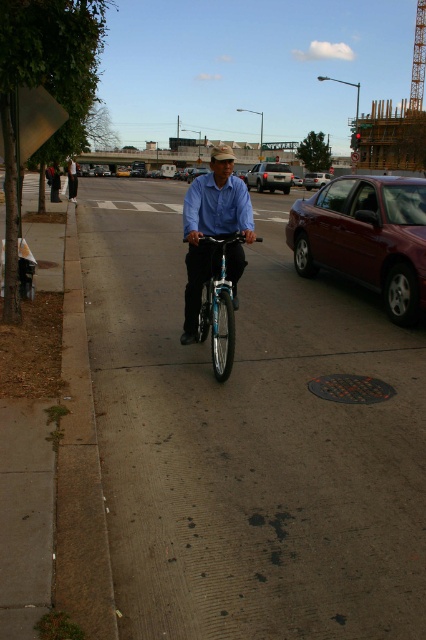
Looking at this image, who is shorter, matte silver suv at center or metallic silver sedan at center?

With less height is matte silver suv at center.

Is matte silver suv at center bigger than metallic silver sedan at center?

Actually, matte silver suv at center might be smaller than metallic silver sedan at center.

Who is more forward, (281, 173) or (314, 177)?

Point (281, 173) is in front.

Where is `matte silver suv at center`? This screenshot has height=640, width=426. matte silver suv at center is located at coordinates (270, 177).

Is gray concrete sidewalk at center bigger than shiny blue bicycle at center?

Indeed, gray concrete sidewalk at center has a larger size compared to shiny blue bicycle at center.

I want to click on gray concrete sidewalk at center, so click(249, 440).

This screenshot has width=426, height=640. What are the coordinates of `gray concrete sidewalk at center` in the screenshot? It's located at (249, 440).

Is point (233, 241) closer to camera compared to point (328, 177)?

That is True.

Who is positioned more to the right, shiny blue bicycle at center or metallic silver sedan at center?

Positioned to the right is metallic silver sedan at center.

Is point (219, 314) behind point (311, 188)?

No, (219, 314) is in front of (311, 188).

Where is `shiny blue bicycle at center`? shiny blue bicycle at center is located at coordinates (218, 308).